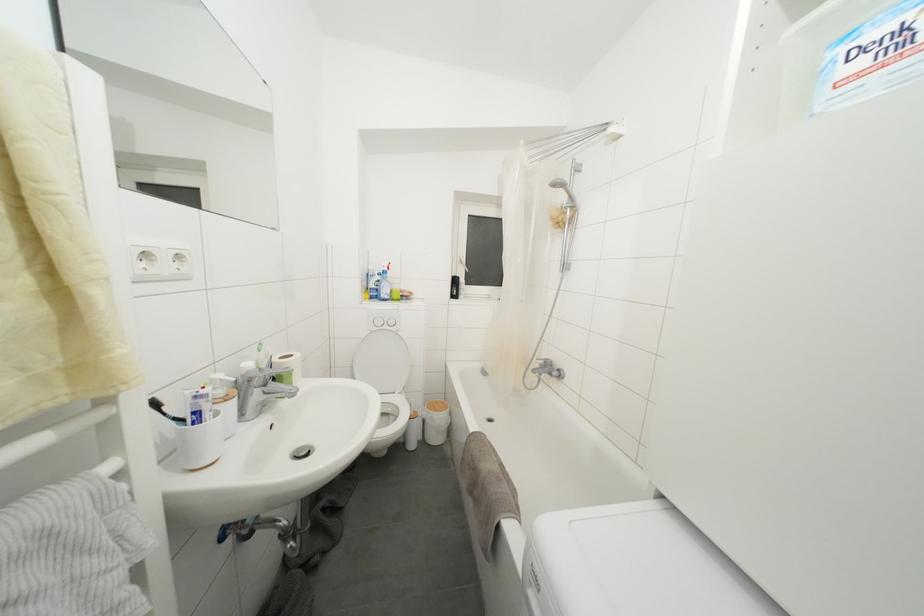
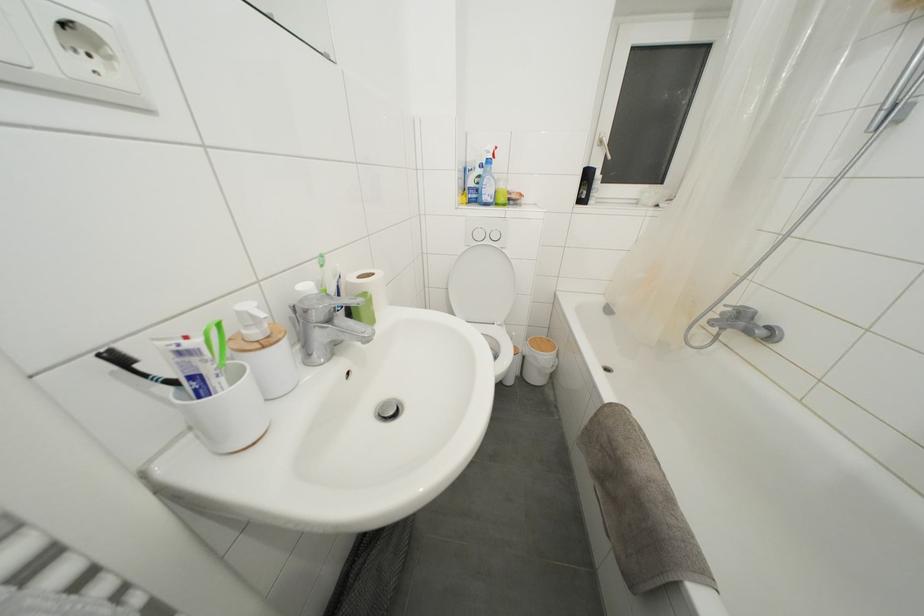
In the second image, find the point that corresponds to [387,301] in the first image.

(490, 203)